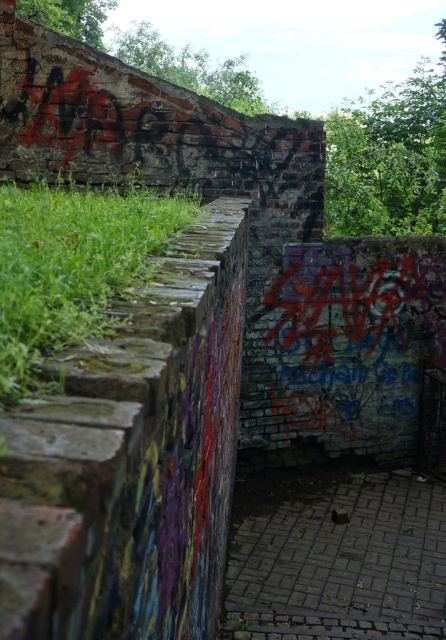
Question: Which of the following is the closest to the observer?

Choices:
 (A) dark brick path at center
 (B) green mossy wall at left

Answer: (B)

Question: Is dark brick path at center smaller than green mossy wall at left?

Choices:
 (A) yes
 (B) no

Answer: (A)

Question: Is the position of dark brick path at center more distant than that of green mossy wall at left?

Choices:
 (A) no
 (B) yes

Answer: (B)

Question: Among these points, which one is farthest from the camera?

Choices:
 (A) (445, 513)
 (B) (54, 284)

Answer: (A)

Question: Considering the relative positions of dark brick path at center and green mossy wall at left in the image provided, where is dark brick path at center located with respect to green mossy wall at left?

Choices:
 (A) below
 (B) above

Answer: (A)